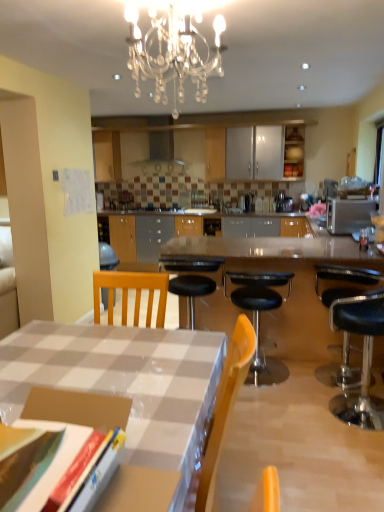
Question: From the image's perspective, is black leather stool at right, the 2th chair in the left-to-right sequence, on top of silver metallic microwave at right?

Choices:
 (A) no
 (B) yes

Answer: (A)

Question: From the image's perspective, is black leather stool at right, the 2th chair in the left-to-right sequence, beneath silver metallic microwave at right?

Choices:
 (A) no
 (B) yes

Answer: (B)

Question: Is black leather stool at right, the 2th chair in the left-to-right sequence, looking in the opposite direction of silver metallic microwave at right?

Choices:
 (A) no
 (B) yes

Answer: (A)

Question: Does black leather stool at right, the 2th chair in the left-to-right sequence, have a greater width compared to silver metallic microwave at right?

Choices:
 (A) yes
 (B) no

Answer: (B)

Question: From a real-world perspective, is black leather stool at right, the 1th chair in the right-to-left sequence, on top of silver metallic microwave at right?

Choices:
 (A) no
 (B) yes

Answer: (A)

Question: Considering the positions of silver metallic microwave at right and black leather stool at center, the 1th chair from the left, in the image, is silver metallic microwave at right wider or thinner than black leather stool at center, the 1th chair from the left,?

Choices:
 (A) wide
 (B) thin

Answer: (B)

Question: From a real-world perspective, is silver metallic microwave at right positioned above or below black leather stool at center, the 1th chair from the left?

Choices:
 (A) below
 (B) above

Answer: (B)

Question: Considering the positions of silver metallic microwave at right and black leather stool at center, acting as the second chair starting from the right, in the image, is silver metallic microwave at right taller or shorter than black leather stool at center, acting as the second chair starting from the right,?

Choices:
 (A) tall
 (B) short

Answer: (B)

Question: Based on their positions, is silver metallic microwave at right located to the left or right of black leather stool at center, acting as the second chair starting from the right?

Choices:
 (A) right
 (B) left

Answer: (A)

Question: In the image, is satin silver metallic exhaust hood at upper center on the left side or the right side of black leather stool at right, the 1th chair in the right-to-left sequence?

Choices:
 (A) left
 (B) right

Answer: (A)

Question: Relative to black leather stool at right, the 1th chair in the right-to-left sequence, is satin silver metallic exhaust hood at upper center in front or behind?

Choices:
 (A) front
 (B) behind

Answer: (B)

Question: Is satin silver metallic exhaust hood at upper center spatially inside black leather stool at right, the 2th chair in the left-to-right sequence, or outside of it?

Choices:
 (A) outside
 (B) inside

Answer: (A)

Question: Is point (134, 163) positioned closer to the camera than point (345, 356)?

Choices:
 (A) closer
 (B) farther

Answer: (B)

Question: Is polished granite table at center in front of or behind matte wood cabinet at upper center in the image?

Choices:
 (A) behind
 (B) front

Answer: (B)

Question: From the image's perspective, is polished granite table at center above or below matte wood cabinet at upper center?

Choices:
 (A) below
 (B) above

Answer: (A)